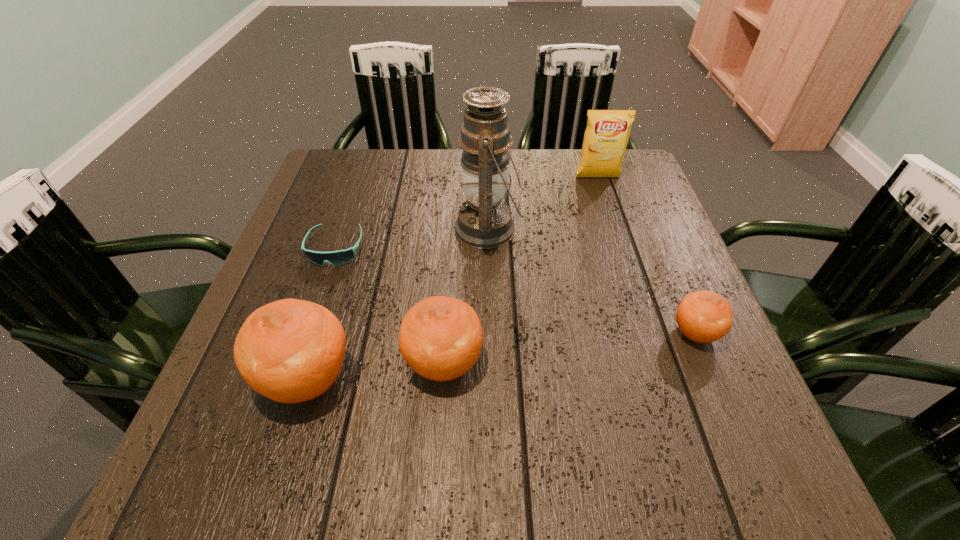
You are a GUI agent. You are given a task and a screenshot of the screen. Output one action in this format:
    pyautogui.click(x=<x>, y=<y>)
    Task: Click on the free space located on the left of the rightmost orange
    
    Given the screenshot: What is the action you would take?
    pyautogui.click(x=470, y=333)

Where is `vacant space positioned on the front of the farthest object with the logo`? vacant space positioned on the front of the farthest object with the logo is located at coordinates (635, 292).

Identify the location of vacant region located 0.260m on the front of the tallest object. The image size is (960, 540). (491, 360).

What are the coordinates of `vacant area situated on the front-facing side of the sunglasses` in the screenshot? It's located at (313, 315).

Identify the location of object that is at the far edge. (606, 136).

Identify the location of orange at the left edge. (290, 351).

Where is `sunglasses situated at the left edge`? sunglasses situated at the left edge is located at coordinates (340, 257).

Locate an element on the screen. The height and width of the screenshot is (540, 960). orange positioned at the right edge is located at coordinates (703, 316).

This screenshot has height=540, width=960. I want to click on crisp (potato chip) that is at the right edge, so click(x=606, y=136).

Image resolution: width=960 pixels, height=540 pixels. What are the coordinates of `object that is at the near left corner` in the screenshot? It's located at (290, 351).